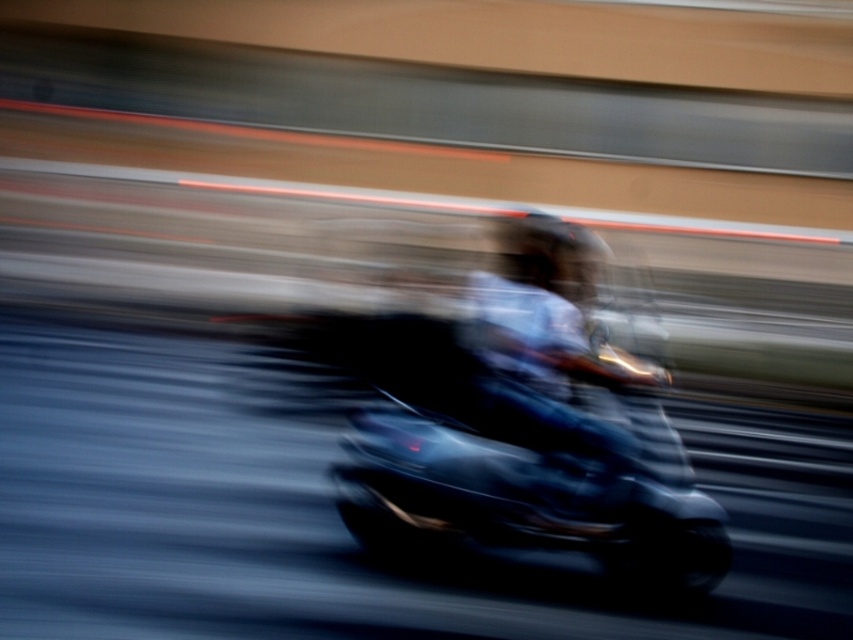
You are a photographer trying to capture a clear photo of the shiny black motorcycle at center and the dark blue helmet at center. The motorcycle is moving, but you can adjust your camera to focus on one object. Which object should you focus on to ensure both are in focus, given their distance apart?

The shiny black motorcycle at center is 12.02 inches away from the dark blue helmet at center. To ensure both are in focus, focus on the shiny black motorcycle at center since it is closer to the camera than the dark blue helmet at center, allowing the motorcycle to be in focus while the helmet may still be within the depth of field.

You are a photographer who wants to capture the motorcycle and helmet in the image. Since the shiny black motorcycle at center and dark blue helmet at center are both at the center, which one appears closer to you?

The shiny black motorcycle at center is closer to you than the dark blue helmet at center because it is positioned further to the viewer in the scene.

You are a photographer who wants to capture the motorcycle and helmet in the image. If you want to ensure both the shiny black motorcycle at center and the dark blue helmet at center are fully visible in your photo, which object should you adjust your camera focus on to account for their sizes?

The shiny black motorcycle at center is wider than the dark blue helmet at center. Therefore, to ensure both are fully visible, you should focus on the shiny black motorcycle at center since it requires more space in the frame due to its greater width.